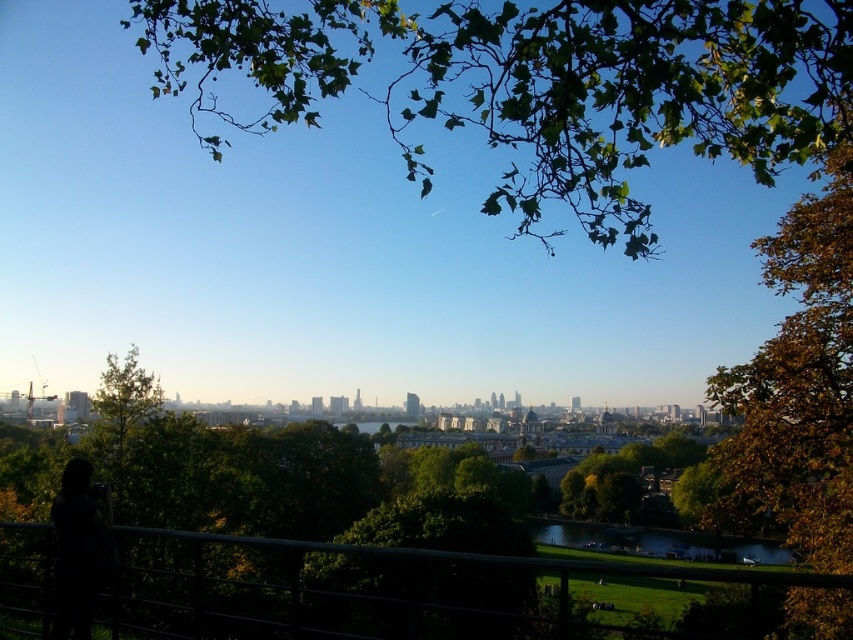
Which is behind, point (538, 61) or point (457, 600)?

Point (538, 61)

Is green leafy branch at upper center positioned at the back of black metal fence at lower center?

Yes, it is behind black metal fence at lower center.

The width and height of the screenshot is (853, 640). I want to click on green leafy branch at upper center, so click(x=538, y=84).

Which of these two, black metal fence at lower center or black matte person at lower left, stands taller?

black metal fence at lower center

Which is in front, point (537, 563) or point (79, 467)?

Point (537, 563) is more forward.

What do you see at coordinates (360, 588) in the screenshot? I see `black metal fence at lower center` at bounding box center [360, 588].

Where is `black metal fence at lower center`? black metal fence at lower center is located at coordinates (360, 588).

Does green leafy branch at upper center have a lesser width compared to brown leafy tree at right?

No, green leafy branch at upper center is not thinner than brown leafy tree at right.

What do you see at coordinates (538, 84) in the screenshot? This screenshot has width=853, height=640. I see `green leafy branch at upper center` at bounding box center [538, 84].

The width and height of the screenshot is (853, 640). What are the coordinates of `green leafy branch at upper center` in the screenshot? It's located at (538, 84).